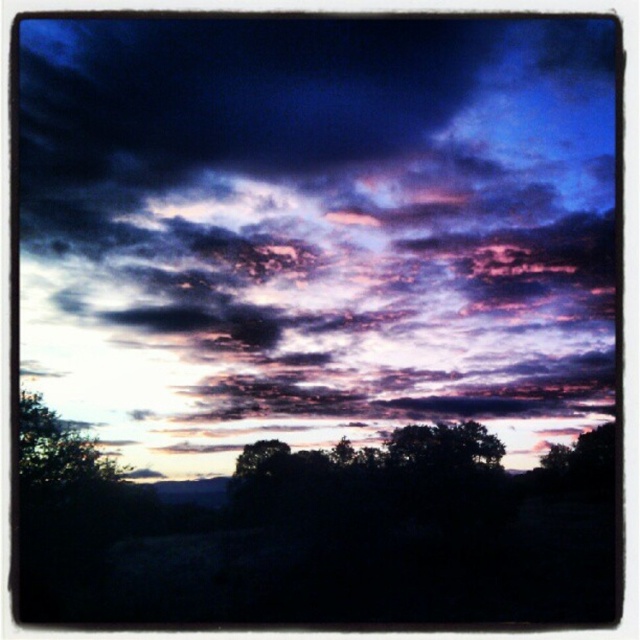
You are standing in the forest and see the green leafy tree at lower left and the dark green leafy tree at center. Which tree is closer to the ground?

The green leafy tree at lower left is located below the dark green leafy tree at center, so it is closer to the ground.

You are an astronomer analyzing the sunset scene. You need to locate the exact coordinates of the purple cotton clouds at upper center. What are their coordinates?

The purple cotton clouds at upper center are located at coordinates point [316,228].

You are an artist trying to paint this sunset scene. You want to ensure that the purple cotton clouds at upper center and the green leafy tree at lower left are spaced exactly 20 inches apart on your canvas. Given the scene you see, will this spacing work?

The purple cotton clouds at upper center and green leafy tree at lower left are 20.41 inches apart from each other, so spacing them at 20 inches on the canvas would be slightly closer than the actual distance but still close enough for artistic interpretation.